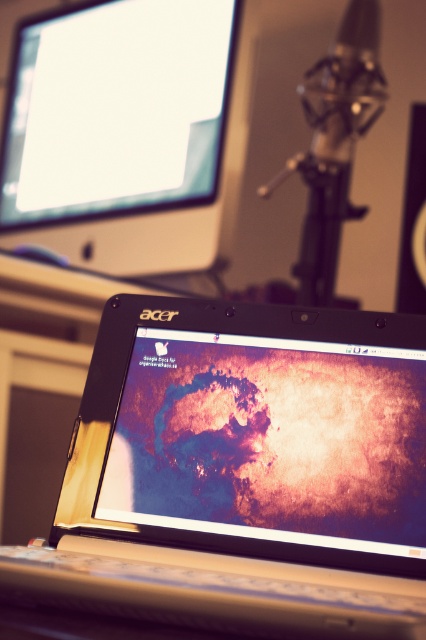
You are standing in front of the workspace setup. There are two points marked in the image, one at coordinate point (233, 525) and another at point (123, 108). Which point is closer to your current position?

Point (233, 525) is closer to the camera than point (123, 108), so the point at coordinate point (233, 525) is closer to your current position.

You are setting up a new microphone stand and need to place it between the matte black monitor at upper left and the metallic silver speaker at center. Based on their positions, which object should the microphone stand be closer to?

The matte black monitor at upper left is closer to the viewer than the metallic silver speaker at center, so the microphone stand should be placed closer to the metallic silver speaker at center to maintain proper spacing between all three items.

You are setting up a new desk and want to place both the metallic silver laptop at center and the metallic silver speaker at center side by side. Based on the image, which object should you place first to ensure they fit properly?

The metallic silver laptop at center is wider than the metallic silver speaker at center. Therefore, you should place the metallic silver laptop at center first to accommodate its larger width before positioning the metallic silver speaker at center next to it.